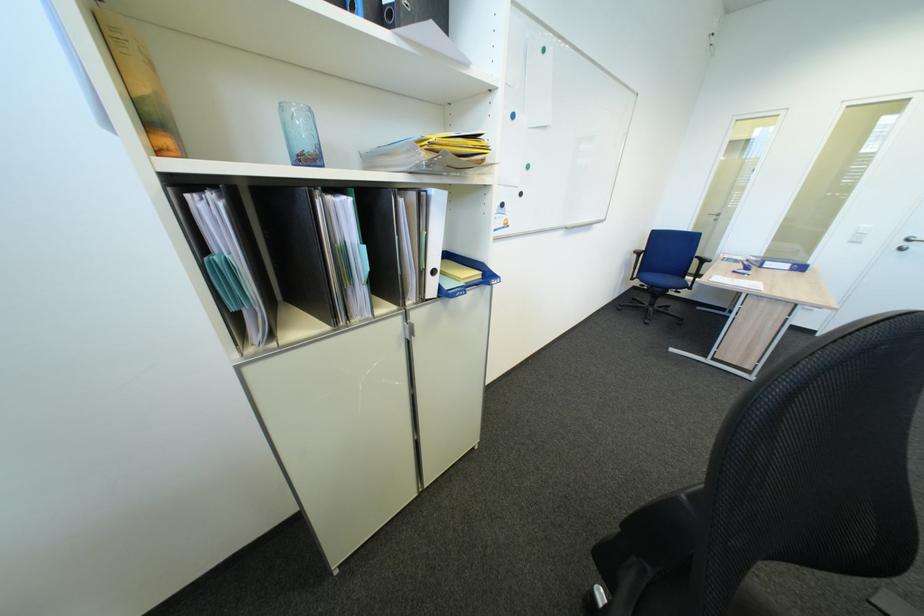
Where would you sit the blue chair sitting surface? Please return your answer as a coordinate pair (x, y).

(662, 281)